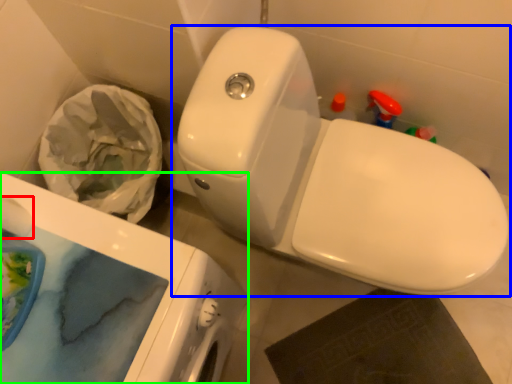
Question: Based on their relative distances, which object is nearer to toilet paper (highlighted by a red box)? Choose from toilet (highlighted by a blue box) and porcelain (highlighted by a green box).

Choices:
 (A) toilet
 (B) porcelain

Answer: (B)